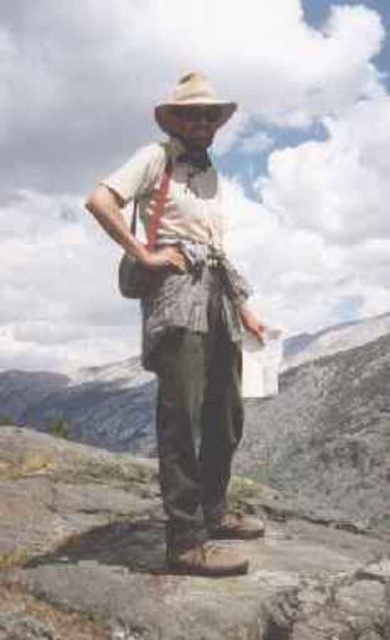
You are a photographer trying to capture the entire scene in one shot. Given that the camouflage pants at center and the light brown felt cowboy hat at center are both in the frame, which object will appear smaller in the photo?

The camouflage pants at center will appear smaller in the photo because it occupies less space than the light brown felt cowboy hat at center.

You are a hiker who wants to know if your camouflage pants at center will be visible against the rocky terrain at center. Based on the scene, which object takes up more space and might make the other harder to see?

The rocky terrain at center occupies more space than the camouflage pants at center, so the camouflage pants at center might be less visible against the rocky terrain at center.